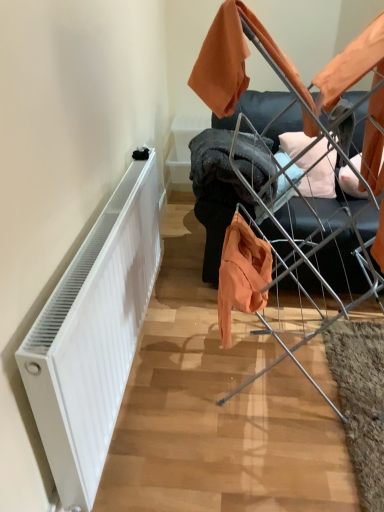
Question: Is white matte radiator at left positioned beyond the bounds of metal wire drying rack at upper right?

Choices:
 (A) no
 (B) yes

Answer: (B)

Question: From a real-world perspective, is white matte radiator at left located higher than metal wire drying rack at upper right?

Choices:
 (A) yes
 (B) no

Answer: (B)

Question: Is white matte radiator at left positioned in front of metal wire drying rack at upper right?

Choices:
 (A) yes
 (B) no

Answer: (A)

Question: Considering the relative positions of white matte radiator at left and metal wire drying rack at upper right in the image provided, is white matte radiator at left to the left of metal wire drying rack at upper right from the viewer's perspective?

Choices:
 (A) yes
 (B) no

Answer: (A)

Question: Is white matte radiator at left surrounding metal wire drying rack at upper right?

Choices:
 (A) yes
 (B) no

Answer: (B)

Question: Considering the relative sizes of white matte radiator at left and metal wire drying rack at upper right in the image provided, is white matte radiator at left shorter than metal wire drying rack at upper right?

Choices:
 (A) yes
 (B) no

Answer: (A)

Question: Considering the relative sizes of metal wire drying rack at upper right and white matte radiator at left in the image provided, is metal wire drying rack at upper right thinner than white matte radiator at left?

Choices:
 (A) yes
 (B) no

Answer: (B)

Question: Is metal wire drying rack at upper right further to camera compared to white matte radiator at left?

Choices:
 (A) no
 (B) yes

Answer: (B)

Question: From the image's perspective, is metal wire drying rack at upper right located beneath white matte radiator at left?

Choices:
 (A) yes
 (B) no

Answer: (B)

Question: Is metal wire drying rack at upper right not within white matte radiator at left?

Choices:
 (A) yes
 (B) no

Answer: (A)

Question: From a real-world perspective, is metal wire drying rack at upper right on white matte radiator at left?

Choices:
 (A) no
 (B) yes

Answer: (B)

Question: Would you say metal wire drying rack at upper right contains white matte radiator at left?

Choices:
 (A) yes
 (B) no

Answer: (B)

Question: Does metallic silver baby carriage at center have a smaller size compared to metal wire drying rack at upper right?

Choices:
 (A) yes
 (B) no

Answer: (B)